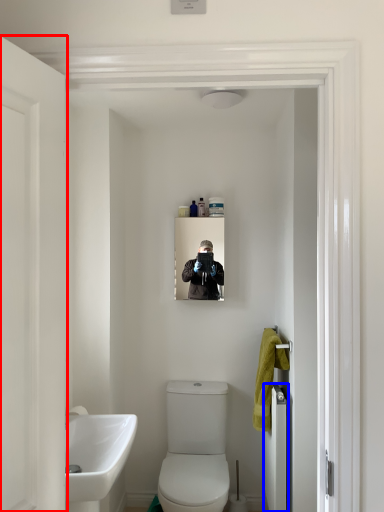
Question: Which point is closer to the camera, door (highlighted by a red box) or door (highlighted by a blue box)?

Choices:
 (A) door
 (B) door

Answer: (A)